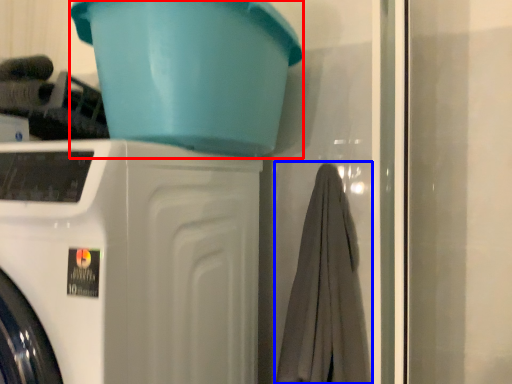
Question: Which of the following is the closest to the observer, basin (highlighted by a red box) or bath towel (highlighted by a blue box)?

Choices:
 (A) basin
 (B) bath towel

Answer: (A)